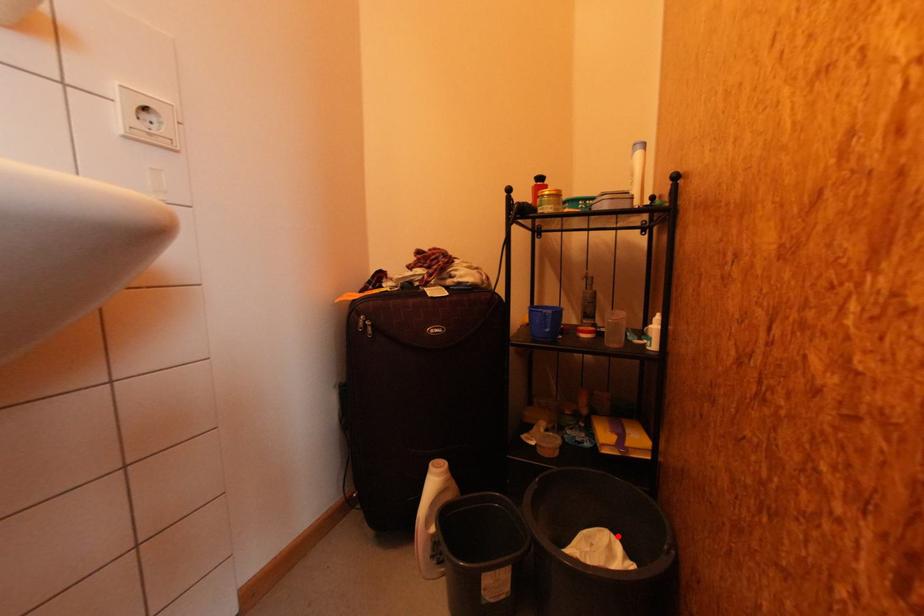
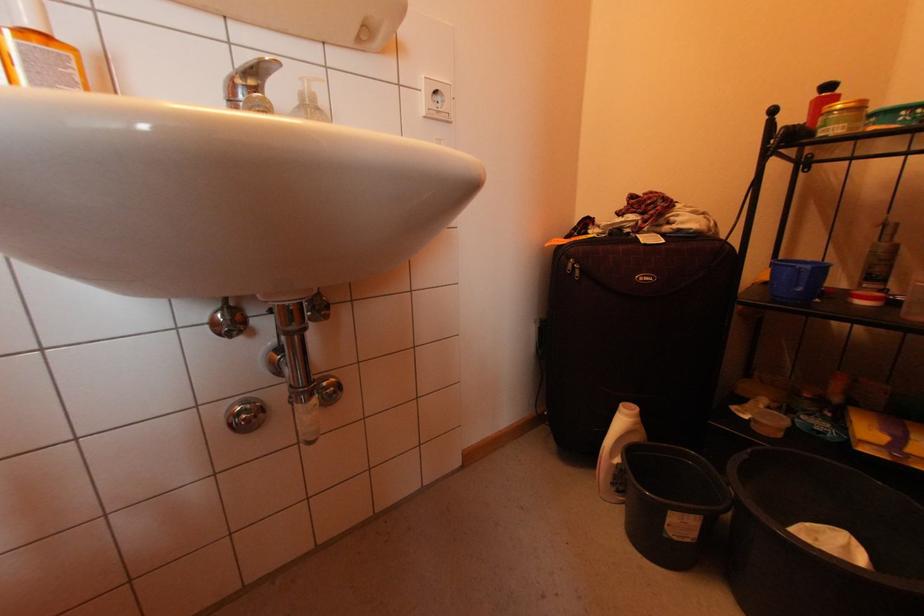
Question: I am providing you with two images of the same scene from different viewpoints. In image1, a red point is highlighted. Considering the same 3D point in image2, which of the following is correct?

Choices:
 (A) It is closer
 (B) It is farther

Answer: (B)